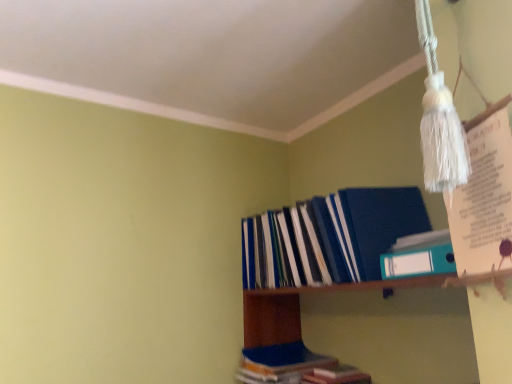
Question: Is teal plastic ring binder at upper right, the third book ordered from the bottom, placed right next to blue hardcover book at lower center, positioned as the first book in bottom-to-top order?

Choices:
 (A) yes
 (B) no

Answer: (B)

Question: Does teal plastic ring binder at upper right, the third book ordered from the bottom, have a lesser width compared to blue hardcover book at lower center, the 3th book from the top?

Choices:
 (A) yes
 (B) no

Answer: (A)

Question: From a real-world perspective, is teal plastic ring binder at upper right, the third book ordered from the bottom, beneath blue hardcover book at lower center, positioned as the first book in bottom-to-top order?

Choices:
 (A) no
 (B) yes

Answer: (A)

Question: Is teal plastic ring binder at upper right, the 1th book from the top, taller than blue hardcover book at lower center, positioned as the first book in bottom-to-top order?

Choices:
 (A) yes
 (B) no

Answer: (B)

Question: Is teal plastic ring binder at upper right, the third book ordered from the bottom, shorter than blue hardcover book at lower center, positioned as the first book in bottom-to-top order?

Choices:
 (A) yes
 (B) no

Answer: (A)

Question: Is blue hardcover book at lower center, the 3th book from the top, at the back of teal plastic ring binder at upper right, the 1th book from the top?

Choices:
 (A) no
 (B) yes

Answer: (A)

Question: Is teal plastic ring binder at upper right, the third book ordered from the bottom, located within blue hardcover book at lower center, the 3th book from the top?

Choices:
 (A) yes
 (B) no

Answer: (B)

Question: From a real-world perspective, is blue hardcover book at lower center, positioned as the first book in bottom-to-top order, physically above teal plastic ring binder at upper right, the 1th book from the top?

Choices:
 (A) no
 (B) yes

Answer: (A)

Question: Considering the relative sizes of blue hardcover book at lower center, the 3th book from the top, and teal plastic ring binder at upper right, the third book ordered from the bottom, in the image provided, is blue hardcover book at lower center, the 3th book from the top, thinner than teal plastic ring binder at upper right, the third book ordered from the bottom,?

Choices:
 (A) yes
 (B) no

Answer: (B)

Question: Is blue hardcover book at lower center, positioned as the first book in bottom-to-top order, not inside teal plastic ring binder at upper right, the 1th book from the top?

Choices:
 (A) yes
 (B) no

Answer: (A)

Question: Considering the relative sizes of blue hardcover book at lower center, positioned as the first book in bottom-to-top order, and teal plastic ring binder at upper right, the third book ordered from the bottom, in the image provided, is blue hardcover book at lower center, positioned as the first book in bottom-to-top order, smaller than teal plastic ring binder at upper right, the third book ordered from the bottom,?

Choices:
 (A) yes
 (B) no

Answer: (B)

Question: Is blue hardcover book at lower center, positioned as the first book in bottom-to-top order, to the right of teal plastic ring binder at upper right, the third book ordered from the bottom, from the viewer's perspective?

Choices:
 (A) no
 (B) yes

Answer: (A)

Question: Is blue plastic folder at upper right closer to the viewer compared to blue hardcover book at lower center, the 3th book from the top?

Choices:
 (A) yes
 (B) no

Answer: (A)